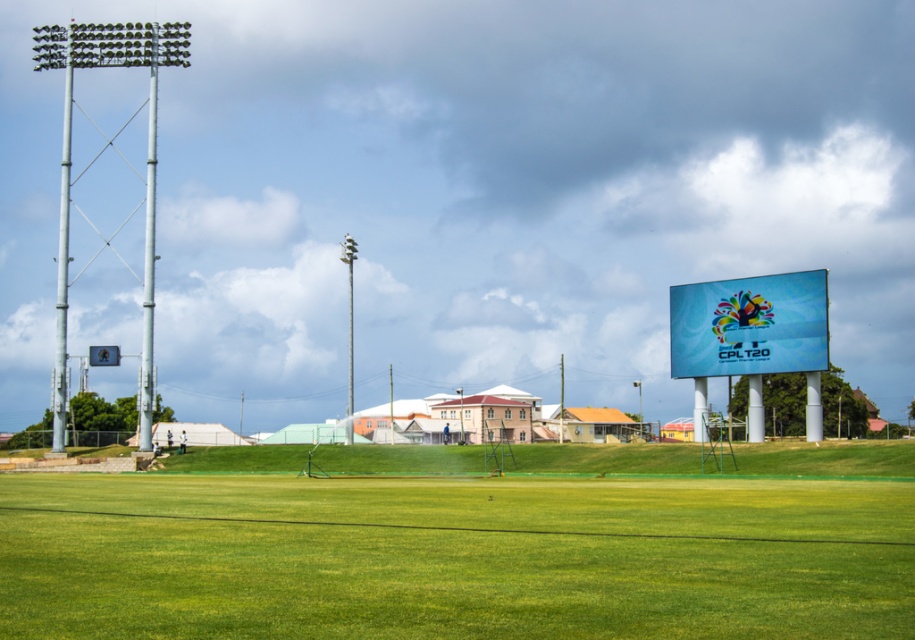
Between point (271, 534) and point (679, 312), which one is positioned behind?

The point (679, 312) is more distant.

Who is positioned more to the left, green grass field at center or blue glossy sign at upper right?

green grass field at center

Does point (860, 573) lie in front of point (813, 326)?

Yes, point (860, 573) is in front of point (813, 326).

At what (x,y) coordinates should I click in order to perform the action: click on green grass field at center. Please return your answer as a coordinate pair (x, y). Looking at the image, I should click on (451, 557).